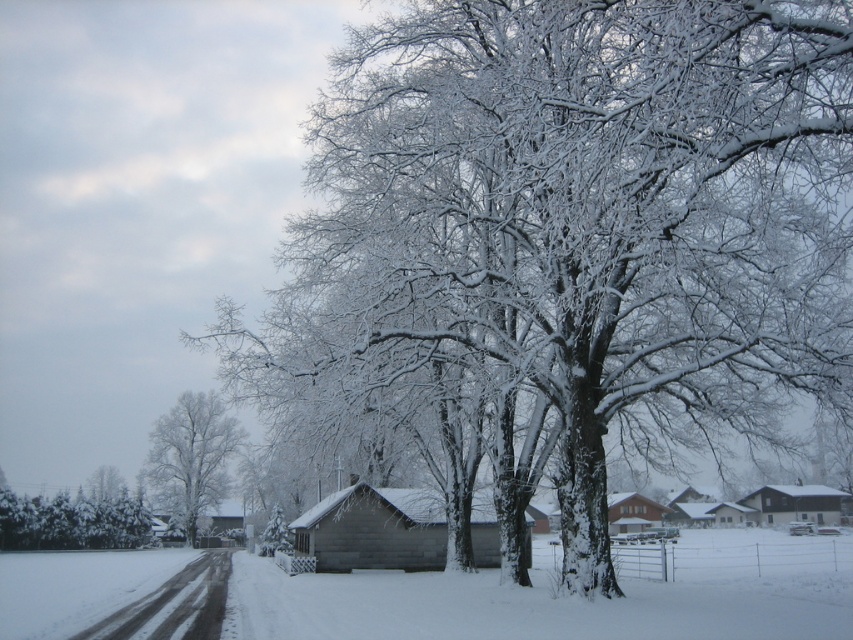
You are planning to build a shed between the wooden barn at center and the wooden cabin at center. Which structure should you place the shed closer to if you want it to be near the larger one?

The wooden barn at center is bigger than the wooden cabin at center, so you should place the shed closer to the wooden barn at center.

You are standing at point (373,529) in the winter scene. What object are you standing on?

You are standing on the wooden barn at center located at point (373,529).